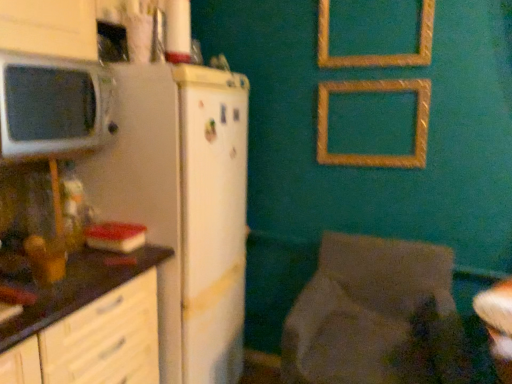
Locate an element on the screen. This screenshot has height=384, width=512. matte white microwave at left is located at coordinates (52, 106).

Measure the distance between matte white microwave at left and camera.

matte white microwave at left and camera are 1.07 meters apart.

The image size is (512, 384). What do you see at coordinates (498, 325) in the screenshot?
I see `white glossy table at lower right` at bounding box center [498, 325].

Identify the location of dark brown laminate countertop at left. [80, 288].

The image size is (512, 384). In order to click on white matte refrigerator at left in this screenshot , I will do `click(183, 205)`.

The image size is (512, 384). Identify the location of textured fabric chair at lower right. (375, 316).

What do you see at coordinates (376, 55) in the screenshot?
I see `gold textured picture frame at upper center, the 1th picture frame positioned from the top` at bounding box center [376, 55].

You are a GUI agent. You are given a task and a screenshot of the screen. Output one action in this format:
    pyautogui.click(x=<x>, y=<y>)
    Task: Click on the matte white microwave at left
    This screenshot has width=512, height=384.
    Given the screenshot: What is the action you would take?
    pyautogui.click(x=52, y=106)

How different are the orientations of dark brown laminate countertop at left and gold textured picture frame at upper center, which is counted as the second picture frame, starting from the bottom, in degrees?

The angle between the facing direction of dark brown laminate countertop at left and the facing direction of gold textured picture frame at upper center, which is counted as the second picture frame, starting from the bottom, is 89.7 degrees.

Which object is wider, dark brown laminate countertop at left or gold textured picture frame at upper center, which is counted as the second picture frame, starting from the bottom?

dark brown laminate countertop at left.

Considering the sizes of objects dark brown laminate countertop at left and gold textured picture frame at upper center, which is counted as the second picture frame, starting from the bottom, in the image provided, who is bigger, dark brown laminate countertop at left or gold textured picture frame at upper center, which is counted as the second picture frame, starting from the bottom,?

Bigger between the two is dark brown laminate countertop at left.

Is dark brown laminate countertop at left spatially inside gold textured picture frame at upper center, the 1th picture frame positioned from the top, or outside of it?

dark brown laminate countertop at left lies outside gold textured picture frame at upper center, the 1th picture frame positioned from the top.

Considering the relative sizes of white matte refrigerator at left and dark brown laminate countertop at left in the image provided, is white matte refrigerator at left bigger than dark brown laminate countertop at left?

Yes.

From the picture: From the image's perspective, between white matte refrigerator at left and dark brown laminate countertop at left, which one is located above?

white matte refrigerator at left appears higher in the image.

Between white matte refrigerator at left and dark brown laminate countertop at left, which one appears on the left side from the viewer's perspective?

dark brown laminate countertop at left is more to the left.

Are textured fabric chair at lower right and gold textured picture frame at upper center, which is the 2th picture frame from top to bottom, located far from each other?

No.

The image size is (512, 384). What are the coordinates of `chair in front of the gold textured picture frame at upper center, which is the 2th picture frame from top to bottom` in the screenshot? It's located at pos(375,316).

Is textured fabric chair at lower right oriented towards gold textured picture frame at upper center, which is counted as the 1th picture frame, starting from the bottom?

No, textured fabric chair at lower right is not oriented towards gold textured picture frame at upper center, which is counted as the 1th picture frame, starting from the bottom.

From the image's perspective, relative to gold textured picture frame at upper center, which is counted as the 1th picture frame, starting from the bottom, is textured fabric chair at lower right above or below?

textured fabric chair at lower right is situated lower than gold textured picture frame at upper center, which is counted as the 1th picture frame, starting from the bottom, in the image.

Considering the positions of point (419, 111) and point (483, 301), is point (419, 111) closer or farther from the camera than point (483, 301)?

Point (419, 111) appears to be farther away from the viewer than point (483, 301).

Between gold textured picture frame at upper center, which is the 2th picture frame from top to bottom, and white glossy table at lower right, which one has larger size?

With larger size is gold textured picture frame at upper center, which is the 2th picture frame from top to bottom.

From a real-world perspective, which is physically above, gold textured picture frame at upper center, which is counted as the 1th picture frame, starting from the bottom, or white glossy table at lower right?

From a 3D spatial view, gold textured picture frame at upper center, which is counted as the 1th picture frame, starting from the bottom, is above.

Is gold textured picture frame at upper center, which is the 2th picture frame from top to bottom, positioned with its back to white glossy table at lower right?

No, white glossy table at lower right is not at the back of gold textured picture frame at upper center, which is the 2th picture frame from top to bottom.

Does point (441, 262) appear closer or farther from the camera than point (224, 344)?

Point (441, 262).

In the scene shown: Is textured fabric chair at lower right behind white matte refrigerator at left?

No, the depth of textured fabric chair at lower right is less than that of white matte refrigerator at left.

Considering the positions of objects textured fabric chair at lower right and white matte refrigerator at left in the image provided, who is more to the right, textured fabric chair at lower right or white matte refrigerator at left?

From the viewer's perspective, textured fabric chair at lower right appears more on the right side.

From a real-world perspective, which is physically above, dark brown laminate countertop at left or matte white microwave at left?

In real-world perspective, matte white microwave at left is above.

From the image's perspective, is dark brown laminate countertop at left over matte white microwave at left?

Incorrect, from the image's perspective, dark brown laminate countertop at left is lower than matte white microwave at left.

Which of these two, dark brown laminate countertop at left or matte white microwave at left, stands taller?

With more height is dark brown laminate countertop at left.

Which is more to the right, dark brown laminate countertop at left or matte white microwave at left?

dark brown laminate countertop at left is more to the right.

Consider the image. From the image's perspective, is white matte refrigerator at left located beneath gold textured picture frame at upper center, which is counted as the 1th picture frame, starting from the bottom?

Indeed, from the image's perspective, white matte refrigerator at left is shown beneath gold textured picture frame at upper center, which is counted as the 1th picture frame, starting from the bottom.

Considering the sizes of white matte refrigerator at left and gold textured picture frame at upper center, which is counted as the 1th picture frame, starting from the bottom, in the image, is white matte refrigerator at left taller or shorter than gold textured picture frame at upper center, which is counted as the 1th picture frame, starting from the bottom,?

white matte refrigerator at left is taller than gold textured picture frame at upper center, which is counted as the 1th picture frame, starting from the bottom.

Is white matte refrigerator at left located outside gold textured picture frame at upper center, which is counted as the 1th picture frame, starting from the bottom?

Absolutely, white matte refrigerator at left is external to gold textured picture frame at upper center, which is counted as the 1th picture frame, starting from the bottom.

I want to click on countertop below the gold textured picture frame at upper center, which is counted as the second picture frame, starting from the bottom (from the image's perspective), so click(x=80, y=288).

I want to click on countertop that is in front of the white matte refrigerator at left, so click(80, 288).

Estimate the real-world distances between objects in this image. Which object is further from matte white microwave at left, white matte refrigerator at left or textured fabric chair at lower right?

textured fabric chair at lower right is further to matte white microwave at left.

Looking at the image, which one is located further to white matte refrigerator at left, matte white microwave at left or white glossy table at lower right?

Among the two, white glossy table at lower right is located further to white matte refrigerator at left.

Looking at the image, which one is located further to white glossy table at lower right, gold textured picture frame at upper center, which is the 2th picture frame from top to bottom, or dark brown laminate countertop at left?

dark brown laminate countertop at left is further to white glossy table at lower right.

Estimate the real-world distances between objects in this image. Which object is closer to gold textured picture frame at upper center, which is counted as the 1th picture frame, starting from the bottom, dark brown laminate countertop at left or white glossy table at lower right?

Among the two, white glossy table at lower right is located nearer to gold textured picture frame at upper center, which is counted as the 1th picture frame, starting from the bottom.

Considering their positions, is dark brown laminate countertop at left positioned further to matte white microwave at left than gold textured picture frame at upper center, which is the 2th picture frame from top to bottom?

Based on the image, gold textured picture frame at upper center, which is the 2th picture frame from top to bottom, appears to be further to matte white microwave at left.

From the image, which object appears to be nearer to gold textured picture frame at upper center, which is counted as the second picture frame, starting from the bottom, gold textured picture frame at upper center, which is the 2th picture frame from top to bottom, or matte white microwave at left?

Among the two, gold textured picture frame at upper center, which is the 2th picture frame from top to bottom, is located nearer to gold textured picture frame at upper center, which is counted as the second picture frame, starting from the bottom.

From the image, which object appears to be nearer to textured fabric chair at lower right, gold textured picture frame at upper center, which is the 2th picture frame from top to bottom, or white matte refrigerator at left?

The object closer to textured fabric chair at lower right is white matte refrigerator at left.

Looking at this image, estimate the real-world distances between objects in this image. Which object is further from white matte refrigerator at left, matte white microwave at left or dark brown laminate countertop at left?

Among the two, matte white microwave at left is located further to white matte refrigerator at left.

This screenshot has width=512, height=384. In order to click on picture frame between gold textured picture frame at upper center, which is counted as the second picture frame, starting from the bottom, and textured fabric chair at lower right, in the vertical direction in this screenshot , I will do pyautogui.click(x=375, y=92).

In order to click on countertop between gold textured picture frame at upper center, which is counted as the second picture frame, starting from the bottom, and textured fabric chair at lower right from top to bottom in this screenshot , I will do `click(80, 288)`.

Identify the location of chair between dark brown laminate countertop at left and white glossy table at lower right from left to right. This screenshot has height=384, width=512. (375, 316).

Image resolution: width=512 pixels, height=384 pixels. I want to click on refrigerator situated between dark brown laminate countertop at left and gold textured picture frame at upper center, which is counted as the 1th picture frame, starting from the bottom, from left to right, so click(x=183, y=205).